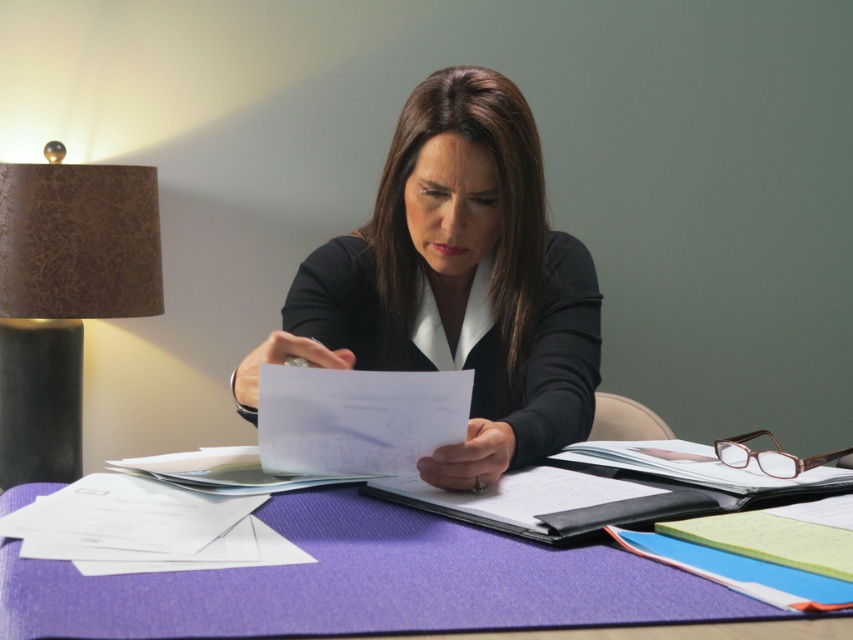
You are a delivery person who needs to place a small package on the desk without disturbing the purple fabric at center or the black leather notebook at center. Which object should you avoid placing the package near to ensure it doesn not fall off the desk?

You should avoid placing the package near the purple fabric at center because it is closer to the edge of the desk than the black leather notebook at center, making it more likely to fall off.

You are an office assistant who needs to place a new document on the desk. The purple fabric at center and the black leather notebook at center are in the way. Which object should you move to the right to make space?

The purple fabric at center is positioned on the left side of black leather notebook at center, so moving the purple fabric at center to the right would create space.